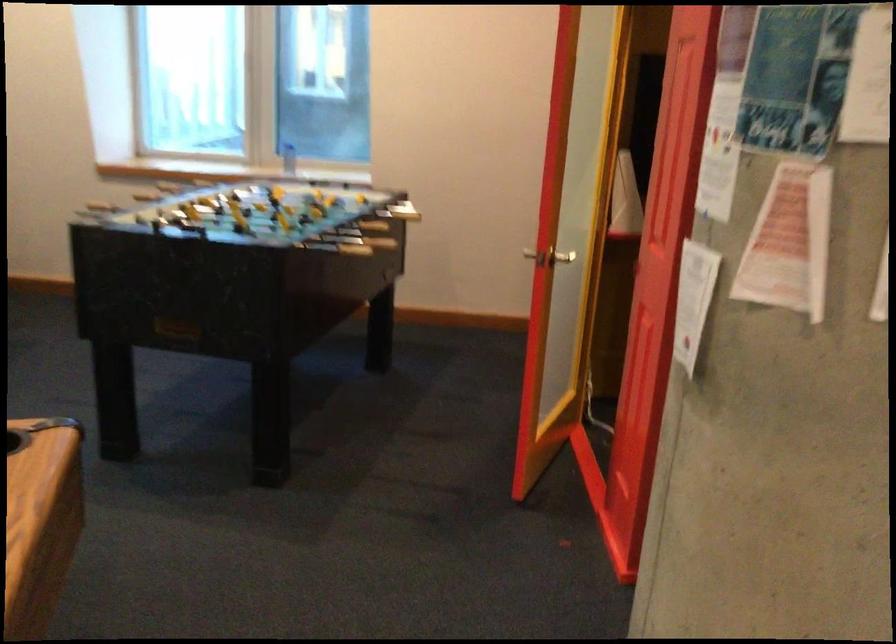
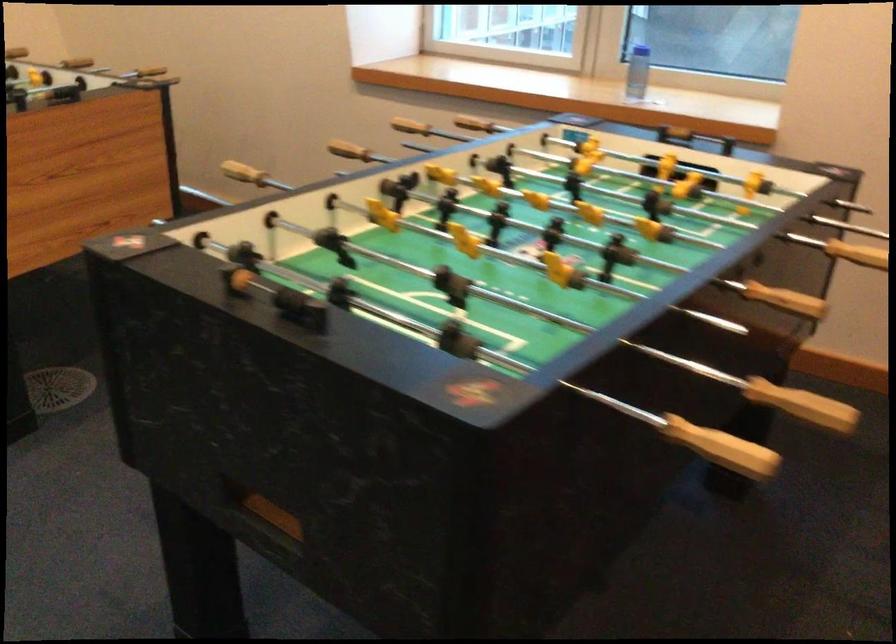
Question: The images are taken continuously from a first-person perspective. In which direction are you moving?

Choices:
 (A) Left
 (B) Right
 (C) Forward
 (D) Backward

Answer: (C)